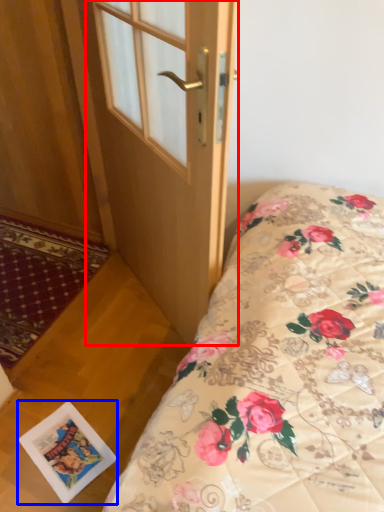
Question: Among these objects, which one is nearest to the camera, door (highlighted by a red box) or postcard (highlighted by a blue box)?

Choices:
 (A) door
 (B) postcard

Answer: (A)